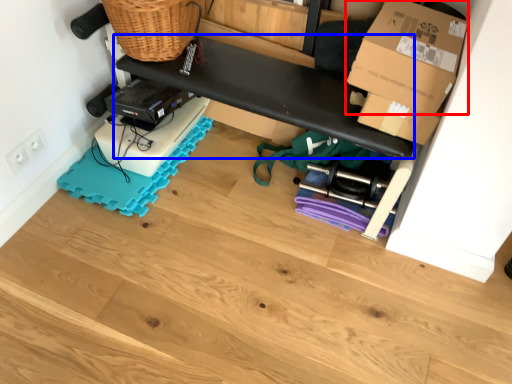
Question: Which point is further to the camera, box (highlighted by a red box) or shelf (highlighted by a blue box)?

Choices:
 (A) box
 (B) shelf

Answer: (B)